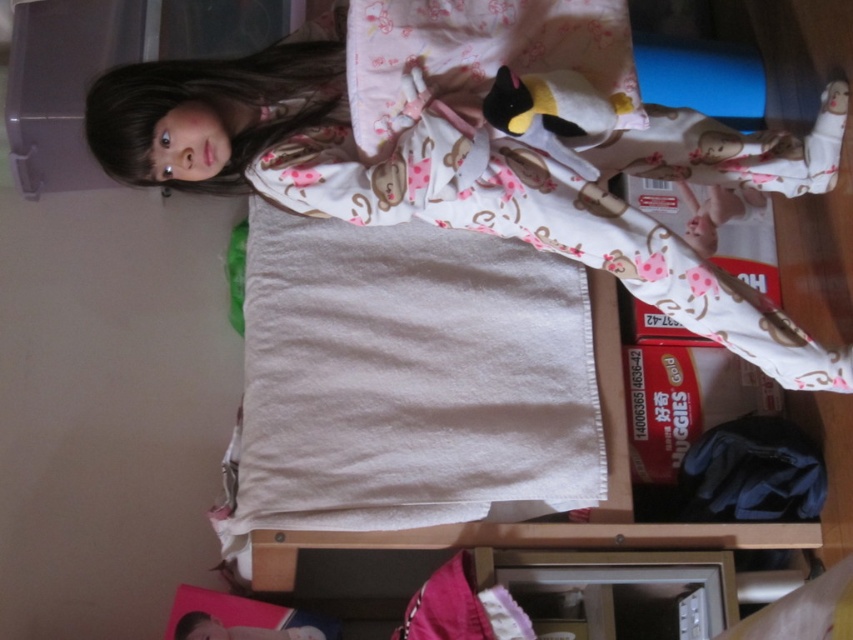
Is white cotton pajamas at upper center shorter than soft plush penguin at upper center?

No, white cotton pajamas at upper center is not shorter than soft plush penguin at upper center.

Who is higher up, white cotton pajamas at upper center or soft plush penguin at upper center?

Positioned higher is soft plush penguin at upper center.

Between point (490, 83) and point (543, 86), which one is positioned behind?

Point (490, 83)

I want to click on white cotton pajamas at upper center, so click(x=474, y=147).